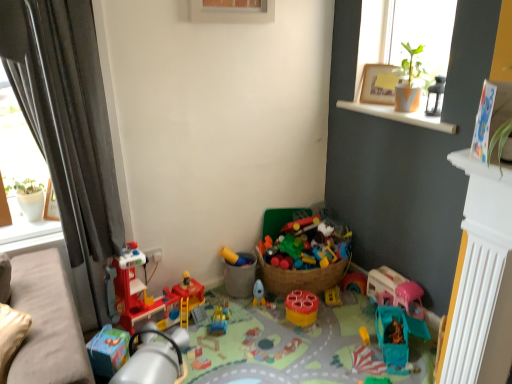
Locate an element on the screen. The width and height of the screenshot is (512, 384). free location in front of matte plastic cup at center, the sixth toy from the left is located at coordinates (308, 335).